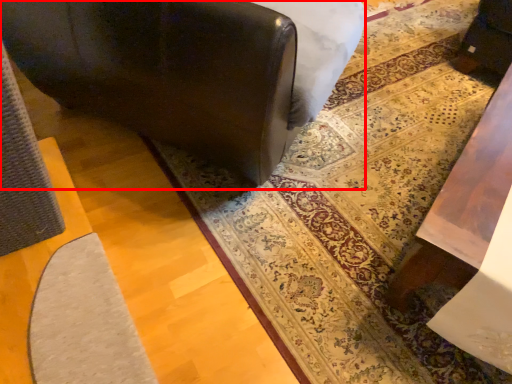
Question: From the image's perspective, considering the relative positions of furniture (annotated by the red box) and mat in the image provided, where is furniture (annotated by the red box) located with respect to the staircase?

Choices:
 (A) above
 (B) below

Answer: (A)